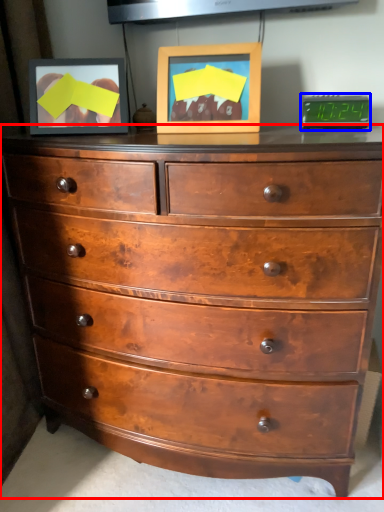
Question: Among these objects, which one is farthest to the camera, chest of drawers (highlighted by a red box) or alarm clock (highlighted by a blue box)?

Choices:
 (A) chest of drawers
 (B) alarm clock

Answer: (B)